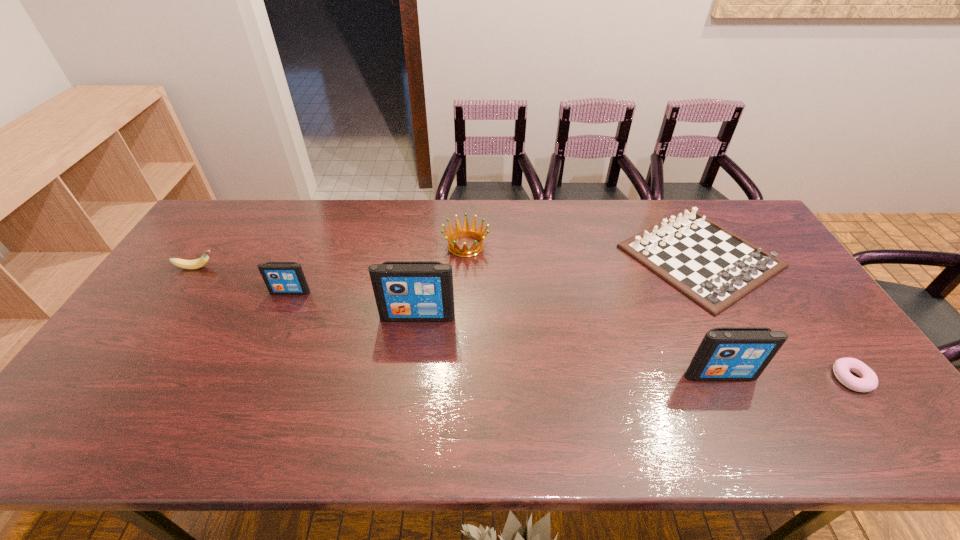
Where is `vacant area situated on the front screen of the second nearest iPod`? Image resolution: width=960 pixels, height=540 pixels. vacant area situated on the front screen of the second nearest iPod is located at coordinates (415, 340).

The height and width of the screenshot is (540, 960). Find the location of `free space located 0.060m on the front screen of the rightmost iPod`. free space located 0.060m on the front screen of the rightmost iPod is located at coordinates coord(732,403).

I want to click on free region located on the back of the chessboard, so click(x=669, y=200).

Identify the location of vacant space located 0.160m on the back of the crown. (468, 205).

I want to click on vacant area located at the stem of the banana, so click(311, 267).

Find the location of a particular element. blank space located 0.340m on the left of the pastry is located at coordinates (696, 379).

I want to click on chessboard located at the far edge, so click(712, 266).

Identify the location of crown located at the far edge. (465, 231).

Find the location of `iPod located at the near edge`. iPod located at the near edge is located at coordinates (726, 353).

Where is `pastry located in the near edge section of the desktop`? The image size is (960, 540). pastry located in the near edge section of the desktop is located at coordinates (868, 381).